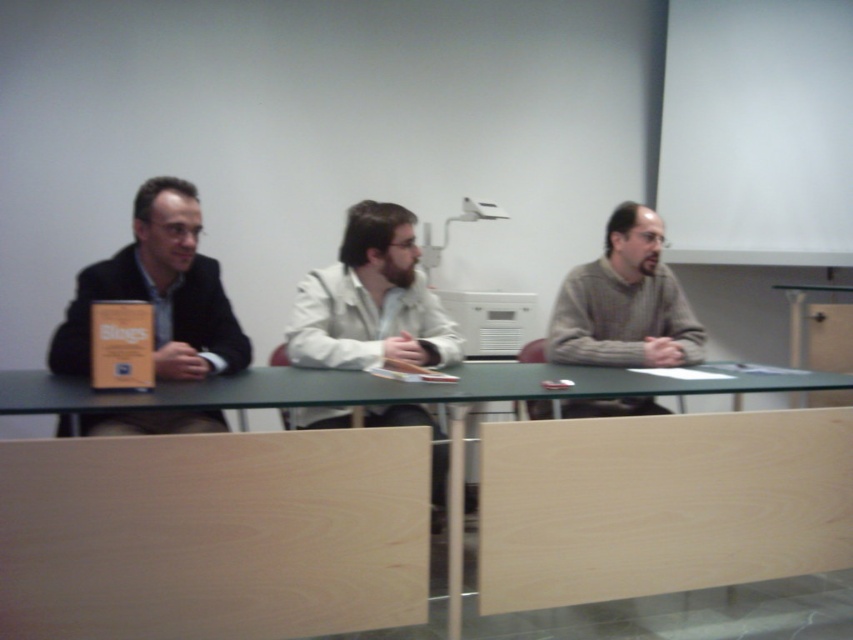
Question: Is matte black jacket at left closer to the viewer compared to green matte table at center?

Choices:
 (A) yes
 (B) no

Answer: (B)

Question: Which object appears farthest from the camera in this image?

Choices:
 (A) green matte table at center
 (B) matte black jacket at left

Answer: (B)

Question: Which object is positioned farthest from the matte black jacket at left?

Choices:
 (A) green matte table at center
 (B) gray sweater at center

Answer: (B)

Question: Which of the following is the closest to the observer?

Choices:
 (A) (186, 244)
 (B) (614, 336)
 (C) (62, 404)

Answer: (C)

Question: Considering the relative positions of matte black jacket at left and gray sweater at center in the image provided, where is matte black jacket at left located with respect to gray sweater at center?

Choices:
 (A) below
 (B) above

Answer: (B)

Question: Does matte black jacket at left have a lesser width compared to green matte table at center?

Choices:
 (A) no
 (B) yes

Answer: (B)